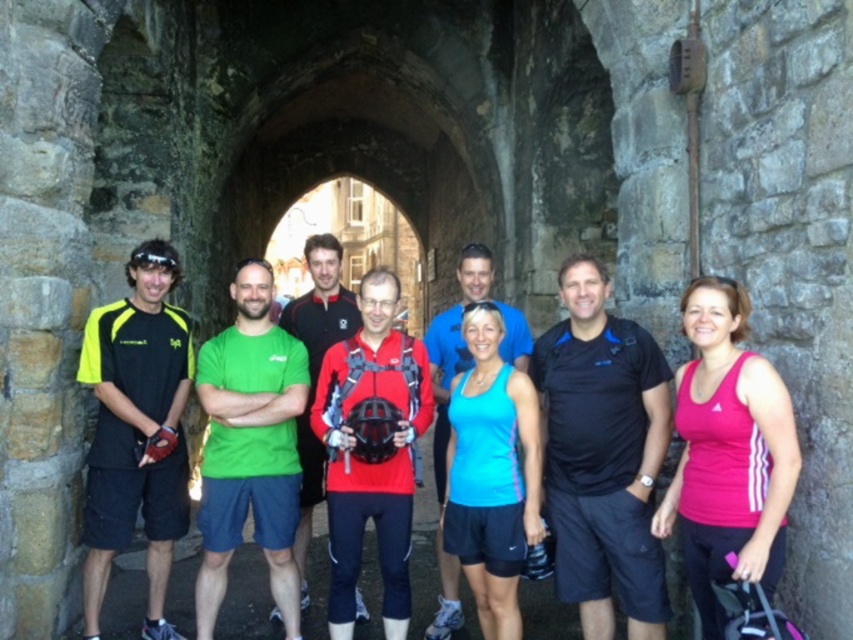
You are a photographer trying to adjust the lighting for a group photo under the stone archway. You notice the neon yellow fabric shirt at left is in a shadowy area. Based on its position coordinates, can you determine if it will be well lit by the sunlight coming from behind the group?

The neon yellow fabric shirt at left is positioned at point 0.673 in the x coordinate and 0.161 in the y coordinate. Since the sunlight is coming from behind the group through the archway, the shirt might still be in shadow unless adjusted. To ensure proper lighting, suggest moving the shirt slightly forward or to the side to catch more light.

You are a photographer trying to adjust the lighting for a group photo. You notice the neon yellow fabric shirt at left is positioned at point [136,429]. Where should you place the fill light to reduce shadows on the neon yellow fabric shirt at left?

The neon yellow fabric shirt at left is located at point [136,429]. To reduce shadows on the neon yellow fabric shirt at left, place the fill light opposite the direction of the main light source. Since the main light is coming from the archway behind the group, positioning the fill light in front of the group near the neon yellow fabric shirt at left would help balance the shadows.